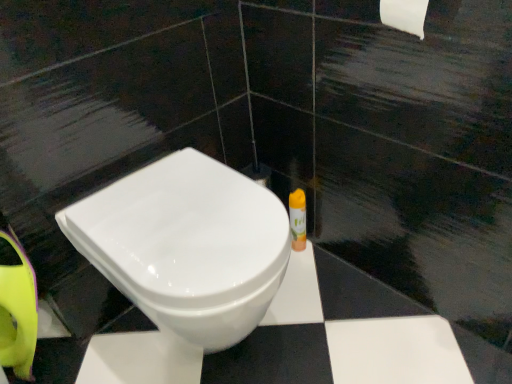
Question: From a real-world perspective, is white glossy toilet at center above or below yellow plastic spray can at right?

Choices:
 (A) below
 (B) above

Answer: (B)

Question: Is white glossy toilet at center in front of or behind yellow plastic spray can at right in the image?

Choices:
 (A) front
 (B) behind

Answer: (A)

Question: Is white glossy toilet at center inside the boundaries of yellow plastic spray can at right, or outside?

Choices:
 (A) inside
 (B) outside

Answer: (B)

Question: Is yellow plastic spray can at right in front of or behind white glossy toilet at center in the image?

Choices:
 (A) behind
 (B) front

Answer: (A)

Question: From the image's perspective, is yellow plastic spray can at right located above or below white glossy toilet at center?

Choices:
 (A) below
 (B) above

Answer: (B)

Question: In the image, is yellow plastic spray can at right on the left side or the right side of white glossy toilet at center?

Choices:
 (A) right
 (B) left

Answer: (A)

Question: Is point (292, 208) positioned closer to the camera than point (221, 226)?

Choices:
 (A) closer
 (B) farther

Answer: (B)